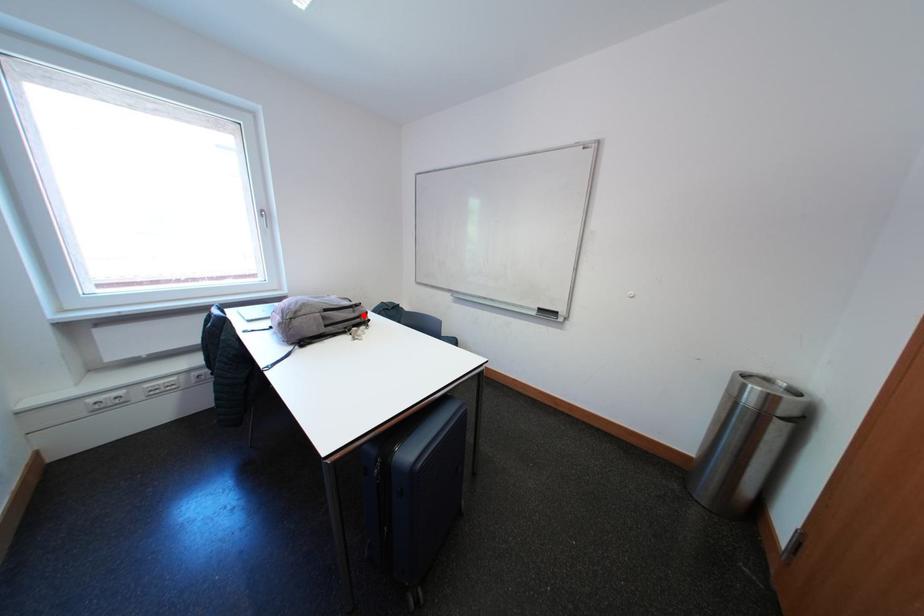
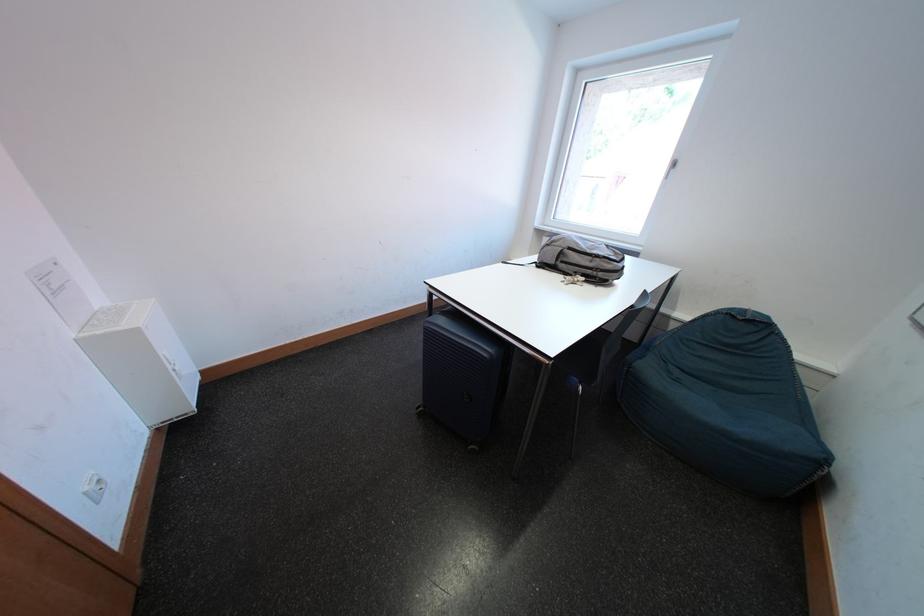
Question: I am providing you with two images of the same scene from different viewpoints. Given a red point in image1, look at the same physical point in image2. Is it:

Choices:
 (A) Closer to the viewpoint
 (B) Farther from the viewpoint

Answer: (B)